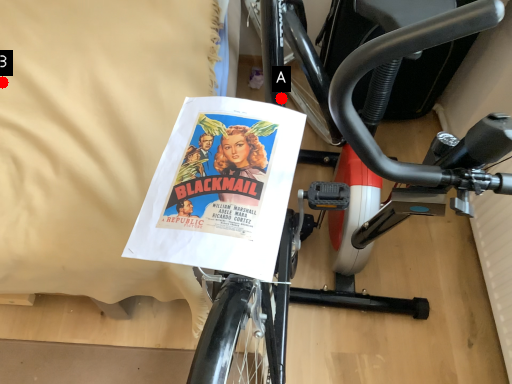
Question: Two points are circled on the image, labeled by A and B beside each circle. Which point appears farthest from the camera in this image?

Choices:
 (A) A is further
 (B) B is further

Answer: (B)